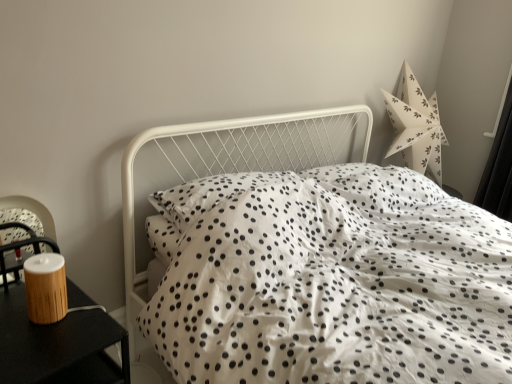
Question: Can you see wooden nightstand at left touching black matte curtain at right?

Choices:
 (A) no
 (B) yes

Answer: (A)

Question: Is wooden nightstand at left to the left of black matte curtain at right from the viewer's perspective?

Choices:
 (A) no
 (B) yes

Answer: (B)

Question: Is there a large distance between wooden nightstand at left and black matte curtain at right?

Choices:
 (A) no
 (B) yes

Answer: (B)

Question: Is black matte curtain at right at the back of wooden nightstand at left?

Choices:
 (A) no
 (B) yes

Answer: (A)

Question: Does wooden nightstand at left contain black matte curtain at right?

Choices:
 (A) yes
 (B) no

Answer: (B)

Question: From their relative heights in the image, would you say white dotted fabric at center is taller or shorter than wooden nightstand at left?

Choices:
 (A) short
 (B) tall

Answer: (B)

Question: Is white dotted fabric at center wider or thinner than wooden nightstand at left?

Choices:
 (A) wide
 (B) thin

Answer: (A)

Question: Considering the positions of white dotted fabric at center and wooden nightstand at left in the image, is white dotted fabric at center bigger or smaller than wooden nightstand at left?

Choices:
 (A) big
 (B) small

Answer: (A)

Question: Does point (509, 228) appear closer or farther from the camera than point (14, 299)?

Choices:
 (A) closer
 (B) farther

Answer: (B)

Question: Is black matte curtain at right taller or shorter than wooden nightstand at left?

Choices:
 (A) short
 (B) tall

Answer: (B)

Question: Choose the correct answer: Is black matte curtain at right inside wooden nightstand at left or outside it?

Choices:
 (A) inside
 (B) outside

Answer: (B)

Question: Is black matte curtain at right wider or thinner than wooden nightstand at left?

Choices:
 (A) thin
 (B) wide

Answer: (A)

Question: Considering the positions of black matte curtain at right and wooden nightstand at left in the image, is black matte curtain at right bigger or smaller than wooden nightstand at left?

Choices:
 (A) big
 (B) small

Answer: (B)

Question: Based on their sizes in the image, would you say white dotted fabric at center is bigger or smaller than black matte curtain at right?

Choices:
 (A) big
 (B) small

Answer: (A)

Question: Is white dotted fabric at center wider or thinner than black matte curtain at right?

Choices:
 (A) thin
 (B) wide

Answer: (B)